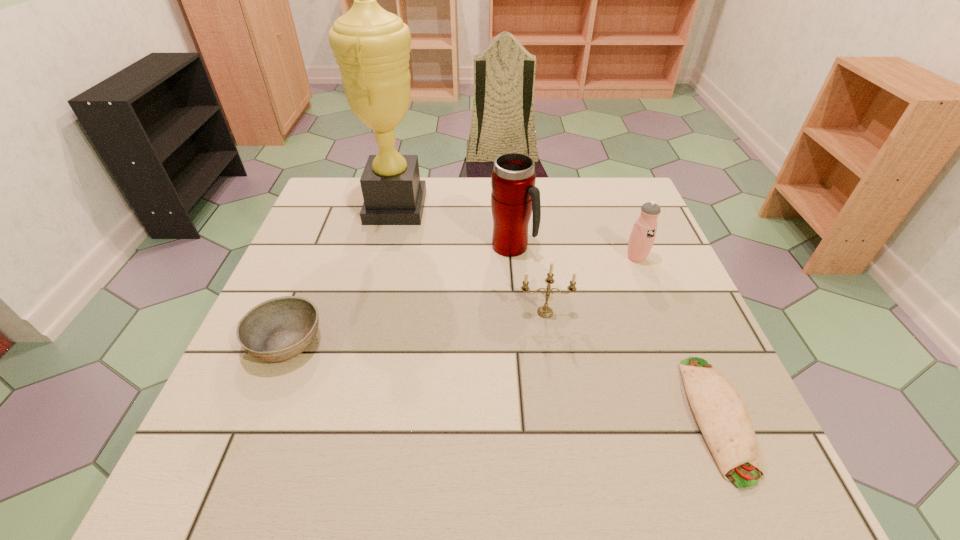
Find the location of `free space between the right thermos bottle and the candle`. free space between the right thermos bottle and the candle is located at coordinates (590, 285).

You are a GUI agent. You are given a task and a screenshot of the screen. Output one action in this format:
    pyautogui.click(x=<x>, y=<y>)
    Task: Click on the free spot between the shorter thermos bottle and the shortest object
    The height and width of the screenshot is (540, 960).
    Given the screenshot: What is the action you would take?
    pyautogui.click(x=677, y=337)

Find the location of a particular element. This screenshot has height=540, width=960. vacant area that lies between the fifth tallest object and the right thermos bottle is located at coordinates coord(461,300).

At what (x,y) coordinates should I click in order to perform the action: click on object that can be found as the third closest to the burrito. Please return your answer as a coordinate pair (x, y). Looking at the image, I should click on (514, 197).

The height and width of the screenshot is (540, 960). In order to click on the second closest object to the bowl in this screenshot , I will do `click(514, 197)`.

This screenshot has width=960, height=540. Identify the location of blank space that satisfies the following two spatial constraints: 1. at the front of the trophy cup with handles; 2. on the left side of the right thermos bottle. point(384,257).

You are a GUI agent. You are given a task and a screenshot of the screen. Output one action in this format:
    pyautogui.click(x=<x>, y=<y>)
    Task: Click on the free space that satisfies the following two spatial constraints: 1. at the front of the shorter thermos bottle with handles; 2. on the left side of the trophy cup
    
    Given the screenshot: What is the action you would take?
    pyautogui.click(x=384, y=257)